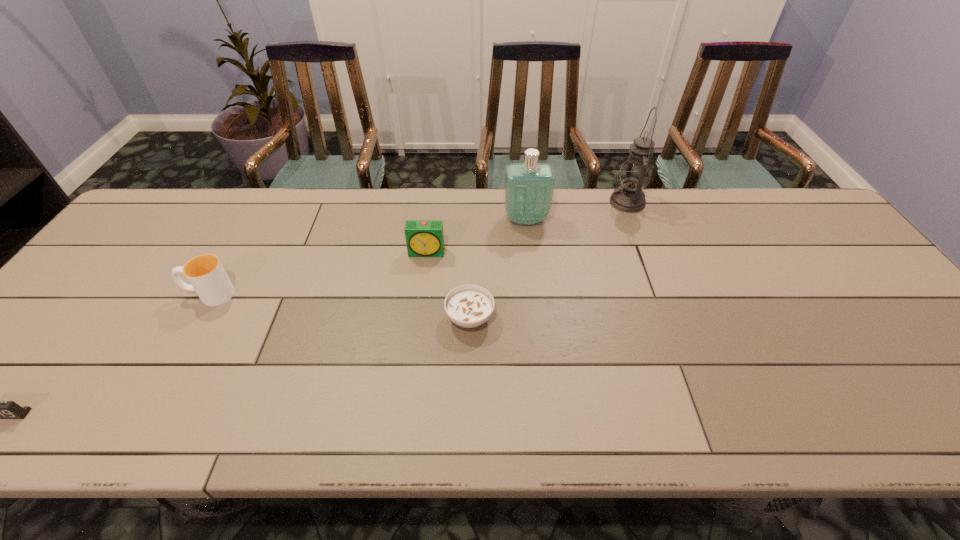
Locate an element on the screen. oil lamp is located at coordinates (635, 173).

At what (x,y) coordinates should I click in order to perform the action: click on the tallest object. Please return your answer as a coordinate pair (x, y). Image resolution: width=960 pixels, height=540 pixels. Looking at the image, I should click on (635, 173).

Identify the location of the second object from right to left. (528, 192).

The height and width of the screenshot is (540, 960). I want to click on the fifth shortest object, so click(x=528, y=192).

At what (x,y) coordinates should I click in order to perform the action: click on the second object from left to right. Please return your answer as a coordinate pair (x, y). The height and width of the screenshot is (540, 960). Looking at the image, I should click on (205, 273).

You are a GUI agent. You are given a task and a screenshot of the screen. Output one action in this format:
    pyautogui.click(x=<x>, y=<y>)
    Task: Click on the third farthest object
    Image resolution: width=960 pixels, height=540 pixels.
    Given the screenshot: What is the action you would take?
    pyautogui.click(x=424, y=238)

In order to click on the taller alarm clock in this screenshot , I will do `click(424, 238)`.

This screenshot has width=960, height=540. In order to click on the fourth object from left to right in this screenshot , I will do `click(469, 306)`.

At what (x,y) coordinates should I click in order to perform the action: click on vacant space located 0.050m on the front of the rightmost object. Please return your answer as a coordinate pair (x, y). This screenshot has height=540, width=960. Looking at the image, I should click on (636, 225).

At what (x,y) coordinates should I click in order to perform the action: click on free space located 0.100m on the front label of the fifth shortest object. Please return your answer as a coordinate pair (x, y). Looking at the image, I should click on (529, 251).